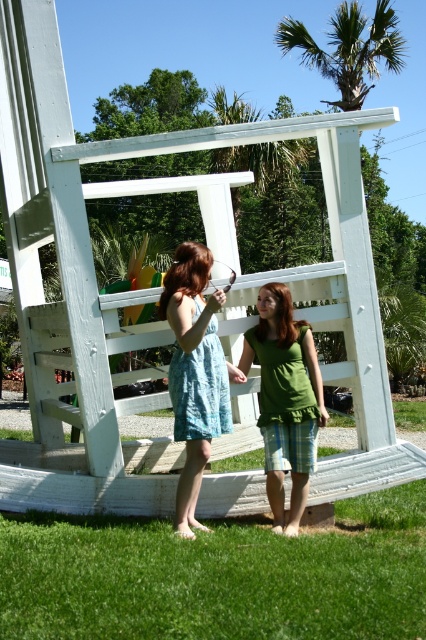
Question: Does green fabric shirt at center appear over green leafy palm tree at upper center?

Choices:
 (A) yes
 (B) no

Answer: (B)

Question: Can you confirm if light blue cotton dress at center is positioned above green leafy palm tree at upper center?

Choices:
 (A) yes
 (B) no

Answer: (B)

Question: Which object is the farthest from the green fabric shirt at center?

Choices:
 (A) light blue cotton dress at center
 (B) green leafy palm tree at upper center

Answer: (B)

Question: Which point is farther to the camera?

Choices:
 (A) (186, 282)
 (B) (275, 451)

Answer: (B)

Question: Which of these objects is positioned farthest from the green leafy palm tree at upper center?

Choices:
 (A) green fabric shirt at center
 (B) light blue cotton dress at center

Answer: (B)

Question: Does green fabric shirt at center appear over green leafy palm tree at upper center?

Choices:
 (A) no
 (B) yes

Answer: (A)